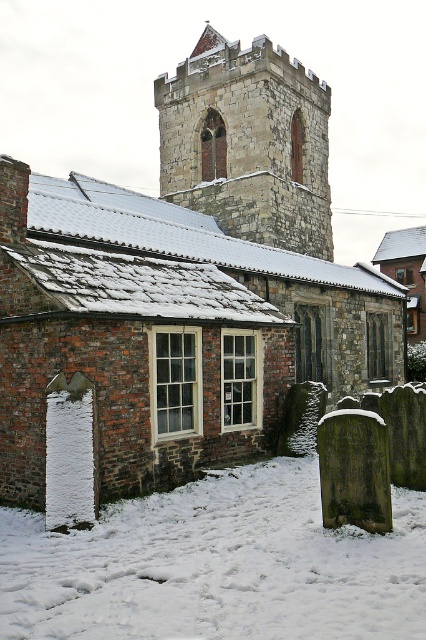
You are an architect analyzing the winter scene. You need to determine which area takes up more visual space in the image between the white powdery snow at lower center and the stone tower at upper center. Which one occupies more area?

The stone tower at upper center occupies more visual space than the white powdery snow at lower center, as the snow covers less area according to the description.

You are standing in the winter scene and want to determine which structure is taller between the white powdery snow at lower center and the stone tower at upper center. Which one is taller?

The stone tower at upper center is taller than the white powdery snow at lower center.